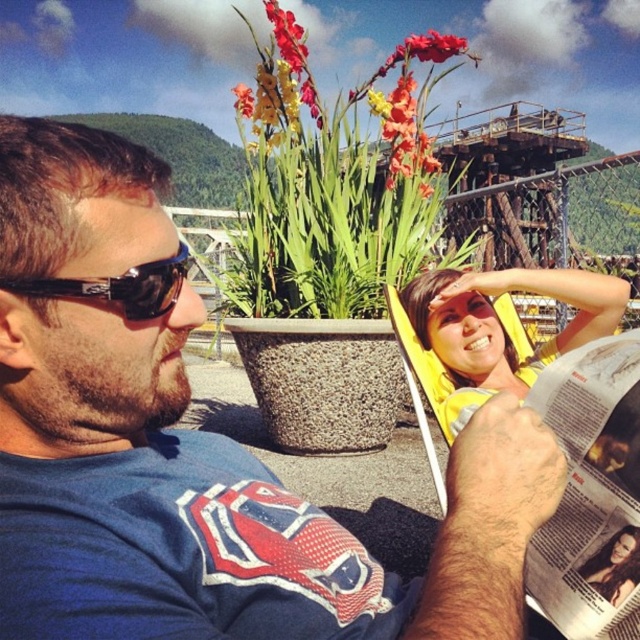
You are a photographer trying to capture a closeup shot of the vivid orange petals at center and the smooth brown hair at center. Which object should you focus on first if you want to ensure both are in focus without adjusting the camera settings?

The vivid orange petals at center are taller than the smooth brown hair at center. To keep both in focus, you should focus on the taller object first, which is the vivid orange petals at center.

You are a photographer trying to capture a clear shot of the blue fabric shirt at center and the black plastic sunglasses at left. Since you want to focus on the shirt, which object should you prioritize positioning closer to the camera?

The blue fabric shirt at center is taller than the black plastic sunglasses at left, so you should prioritize positioning the blue fabric shirt at center closer to the camera to ensure it is the main focus in the photograph.

Looking at this image, you are an interior designer assessing the color coordination in this outdoor scene. The yellow fabric at upper center and the black plastic sunglasses at left are both visible in the composition. Which object would you consider to have a more prominent visual presence due to its size?

The yellow fabric at upper center has a more prominent visual presence because it is larger in size than the black plastic sunglasses at left.